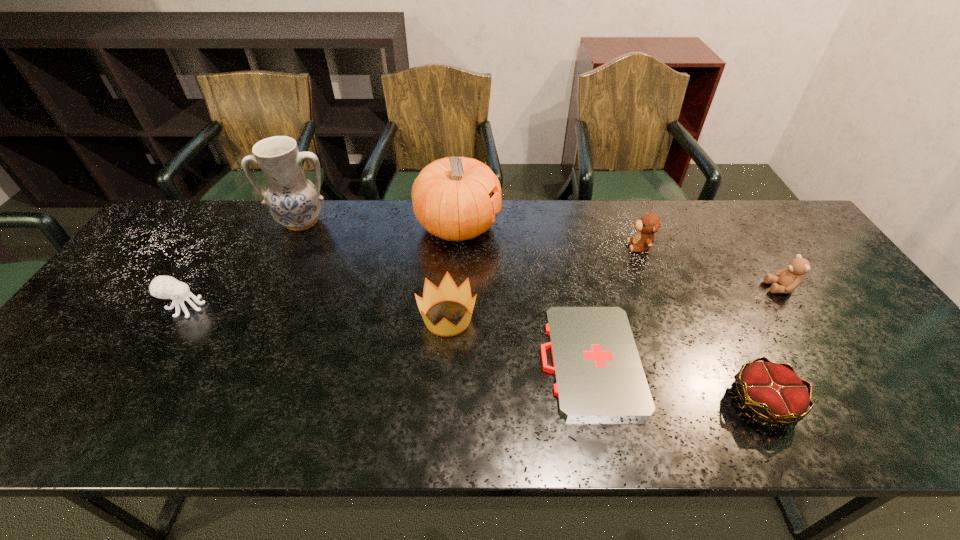
I want to click on vacant space that satisfies the following two spatial constraints: 1. on the back side of the right crown; 2. on the front-facing side of the leftmost object, so click(x=715, y=308).

The height and width of the screenshot is (540, 960). I want to click on vacant area in the image that satisfies the following two spatial constraints: 1. on handle side the first-aid kit; 2. on the right side of the second shortest object, so click(x=598, y=403).

Image resolution: width=960 pixels, height=540 pixels. What are the coordinates of `free space that satisfies the following two spatial constraints: 1. on the front-facing side of the octopus; 2. on the right side of the second object from right to left` in the screenshot? It's located at (127, 403).

At what (x,y) coordinates should I click in order to perform the action: click on vacant space that satisfies the following two spatial constraints: 1. on the face of the right crown; 2. on the right side of the sixth object from left to right. Please return your answer as a coordinate pair (x, y). The height and width of the screenshot is (540, 960). Looking at the image, I should click on (701, 403).